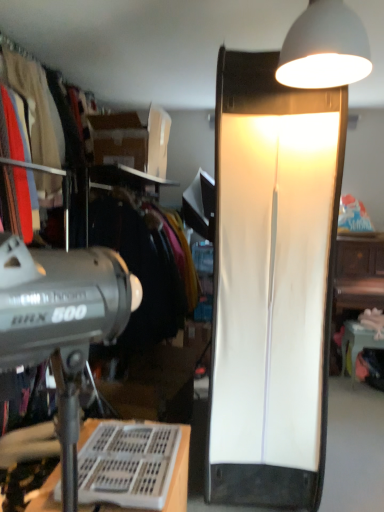
What do you see at coordinates (41, 111) in the screenshot?
I see `matte black clothing at upper left, marked as the first clothing in a back-to-front arrangement` at bounding box center [41, 111].

The width and height of the screenshot is (384, 512). I want to click on white plastic desk at lower left, so click(28, 442).

How much space does white matte lampshade at upper right, the 1th lamp when ordered from bottom to top, occupy vertically?

The height of white matte lampshade at upper right, the 1th lamp when ordered from bottom to top, is 7.06 feet.

This screenshot has width=384, height=512. What do you see at coordinates (37, 108) in the screenshot? I see `smooth cotton shirt at left, placed as the 1th clothing when sorted from front to back` at bounding box center [37, 108].

Identify the location of matte black clothing at upper left, marked as the second clothing in a front-to-back arrangement. (41, 111).

From a real-world perspective, which is physically above, smooth cotton shirt at left, which ranks as the 2th clothing in back-to-front order, or white matte lampshade at upper right, the second lamp when ordered from front to back?

smooth cotton shirt at left, which ranks as the 2th clothing in back-to-front order, is physically above.

Is smooth cotton shirt at left, placed as the 1th clothing when sorted from front to back, to the right of white matte lampshade at upper right, marked as the 1th lamp in a back-to-front arrangement, from the viewer's perspective?

No.

Looking at this image, are smooth cotton shirt at left, placed as the 1th clothing when sorted from front to back, and white matte lampshade at upper right, the second lamp when ordered from front to back, located far from each other?

Yes, smooth cotton shirt at left, placed as the 1th clothing when sorted from front to back, is far from white matte lampshade at upper right, the second lamp when ordered from front to back.

Considering the positions of points (46, 152) and (239, 365), is point (46, 152) farther from camera compared to point (239, 365)?

Yes, it is behind point (239, 365).

Is white matte lampshade at upper right, the 1th lamp when ordered from bottom to top, next to smooth cotton shirt at left, placed as the 1th clothing when sorted from front to back?

No, white matte lampshade at upper right, the 1th lamp when ordered from bottom to top, is not beside smooth cotton shirt at left, placed as the 1th clothing when sorted from front to back.

Could you tell me if white matte lampshade at upper right, the 1th lamp when ordered from bottom to top, is facing smooth cotton shirt at left, which ranks as the 2th clothing in back-to-front order?

No, white matte lampshade at upper right, the 1th lamp when ordered from bottom to top, is not aimed at smooth cotton shirt at left, which ranks as the 2th clothing in back-to-front order.

Which of these two, white matte lampshade at upper right, the second lamp when ordered from front to back, or smooth cotton shirt at left, which ranks as the 2th clothing in back-to-front order, is bigger?

With larger size is white matte lampshade at upper right, the second lamp when ordered from front to back.

Between white matte lampshade at upper right, the second lamp when ordered from front to back, and smooth cotton shirt at left, placed as the 1th clothing when sorted from front to back, which one has smaller width?

smooth cotton shirt at left, placed as the 1th clothing when sorted from front to back.

Is white matte lampshade at upper right, the second lamp viewed from the top, closer to camera compared to white glossy table at lower right?

That is True.

Is white matte lampshade at upper right, the 1th lamp when ordered from bottom to top, inside the boundaries of white glossy table at lower right, or outside?

white matte lampshade at upper right, the 1th lamp when ordered from bottom to top, is spatially situated outside white glossy table at lower right.

Between white matte lampshade at upper right, the second lamp when ordered from front to back, and white glossy table at lower right, which one has larger width?

white matte lampshade at upper right, the second lamp when ordered from front to back, is wider.

Between white matte lampshade at upper right, the second lamp viewed from the top, and white glossy table at lower right, which one has more height?

Standing taller between the two is white matte lampshade at upper right, the second lamp viewed from the top.

Is white glossy table at lower right inside the boundaries of white plastic desk at lower left, or outside?

white glossy table at lower right lies outside white plastic desk at lower left.

Can you confirm if white glossy table at lower right is bigger than white plastic desk at lower left?

Actually, white glossy table at lower right might be smaller than white plastic desk at lower left.

This screenshot has height=512, width=384. Identify the location of table behind the white plastic desk at lower left. (357, 342).

Looking at this image, is white glossy table at lower right beside white plastic desk at lower left?

They are not placed beside each other.

Is white matte lampshade at upper right, positioned as the 1th lamp in front-to-back order, at the back of white matte lampshade at upper right, the 1th lamp when ordered from bottom to top?

No, white matte lampshade at upper right, positioned as the 1th lamp in front-to-back order, is not at the back of white matte lampshade at upper right, the 1th lamp when ordered from bottom to top.

How far apart are white matte lampshade at upper right, the second lamp viewed from the top, and white matte lampshade at upper right, positioned as the 1th lamp in front-to-back order?

20.06 inches.

From the image's perspective, which object appears higher, white matte lampshade at upper right, the second lamp when ordered from front to back, or white matte lampshade at upper right, the first lamp viewed from the top?

white matte lampshade at upper right, the first lamp viewed from the top.

From a real-world perspective, between white matte lampshade at upper right, the second lamp when ordered from front to back, and white matte lampshade at upper right, marked as the second lamp in a back-to-front arrangement, who is vertically higher?

white matte lampshade at upper right, marked as the second lamp in a back-to-front arrangement, is physically above.

In terms of size, does matte black clothing at upper left, marked as the second clothing in a front-to-back arrangement, appear bigger or smaller than white glossy table at lower right?

Considering their sizes, matte black clothing at upper left, marked as the second clothing in a front-to-back arrangement, takes up more space than white glossy table at lower right.

Does point (39, 68) come farther from viewer compared to point (351, 325)?

No, (39, 68) is in front of (351, 325).

Considering their positions, is matte black clothing at upper left, marked as the first clothing in a back-to-front arrangement, located in front of or behind white glossy table at lower right?

Visually, matte black clothing at upper left, marked as the first clothing in a back-to-front arrangement, is located in front of white glossy table at lower right.

Considering the relative positions of matte black clothing at upper left, marked as the first clothing in a back-to-front arrangement, and white glossy table at lower right in the image provided, is matte black clothing at upper left, marked as the first clothing in a back-to-front arrangement, to the left or to the right of white glossy table at lower right?

In the image, matte black clothing at upper left, marked as the first clothing in a back-to-front arrangement, appears on the left side of white glossy table at lower right.

Which point is more distant from viewer, (x=52, y=196) or (x=327, y=376)?

Point (x=52, y=196)

Is white matte lampshade at upper right, the 1th lamp when ordered from bottom to top, a part of matte black clothing at upper left, marked as the first clothing in a back-to-front arrangement?

Actually, white matte lampshade at upper right, the 1th lamp when ordered from bottom to top, is outside matte black clothing at upper left, marked as the first clothing in a back-to-front arrangement.

Looking at this image, would you say matte black clothing at upper left, marked as the second clothing in a front-to-back arrangement, is to the left or to the right of white matte lampshade at upper right, the second lamp viewed from the top, in the picture?

matte black clothing at upper left, marked as the second clothing in a front-to-back arrangement, is to the left of white matte lampshade at upper right, the second lamp viewed from the top.

Considering the positions of objects matte black clothing at upper left, marked as the first clothing in a back-to-front arrangement, and white matte lampshade at upper right, the second lamp when ordered from front to back, in the image provided, who is in front, matte black clothing at upper left, marked as the first clothing in a back-to-front arrangement, or white matte lampshade at upper right, the second lamp when ordered from front to back,?

white matte lampshade at upper right, the second lamp when ordered from front to back.

At what (x,y) coordinates should I click in order to perform the action: click on lamp that is the 1st object located in front of the smooth cotton shirt at left, placed as the 1th clothing when sorted from front to back. Please return your answer as a coordinate pair (x, y). Image resolution: width=384 pixels, height=512 pixels. Looking at the image, I should click on (272, 284).

From the white matte lampshade at upper right, the 1th lamp when ordered from bottom to top, count the 2nd clothing to the left and point to it. Please provide its 2D coordinates.

[(37, 108)]

Estimate the real-world distances between objects in this image. Which object is further from white glossy table at lower right, matte black clothing at upper left, marked as the second clothing in a front-to-back arrangement, or white matte lampshade at upper right, marked as the second lamp in a back-to-front arrangement?

matte black clothing at upper left, marked as the second clothing in a front-to-back arrangement, is further to white glossy table at lower right.

From the image, which object appears to be farther from white matte lampshade at upper right, arranged as the 2th lamp when ordered from the bottom, white matte lampshade at upper right, the second lamp when ordered from front to back, or smooth cotton shirt at left, placed as the 1th clothing when sorted from front to back?

The object further to white matte lampshade at upper right, arranged as the 2th lamp when ordered from the bottom, is smooth cotton shirt at left, placed as the 1th clothing when sorted from front to back.

When comparing their distances from matte black clothing at upper left, marked as the first clothing in a back-to-front arrangement, does white matte lampshade at upper right, arranged as the 2th lamp when ordered from the bottom, or white glossy table at lower right seem further?

white glossy table at lower right is positioned further to the anchor matte black clothing at upper left, marked as the first clothing in a back-to-front arrangement.

Looking at the image, which one is located closer to white matte lampshade at upper right, positioned as the 1th lamp in front-to-back order, matte black clothing at upper left, marked as the second clothing in a front-to-back arrangement, or white plastic desk at lower left?

matte black clothing at upper left, marked as the second clothing in a front-to-back arrangement, is positioned closer to the anchor white matte lampshade at upper right, positioned as the 1th lamp in front-to-back order.

From the image, which object appears to be nearer to white matte lampshade at upper right, the 1th lamp when ordered from bottom to top, smooth cotton shirt at left, placed as the 1th clothing when sorted from front to back, or matte black clothing at upper left, marked as the second clothing in a front-to-back arrangement?

matte black clothing at upper left, marked as the second clothing in a front-to-back arrangement, lies closer to white matte lampshade at upper right, the 1th lamp when ordered from bottom to top, than the other object.

Which object lies further to the anchor point white plastic desk at lower left, white glossy table at lower right or smooth cotton shirt at left, which ranks as the 2th clothing in back-to-front order?

The object further to white plastic desk at lower left is white glossy table at lower right.

From the image, which object appears to be nearer to matte black clothing at upper left, marked as the second clothing in a front-to-back arrangement, white matte lampshade at upper right, marked as the second lamp in a back-to-front arrangement, or white matte lampshade at upper right, marked as the 1th lamp in a back-to-front arrangement?

white matte lampshade at upper right, marked as the 1th lamp in a back-to-front arrangement.

Looking at the image, which one is located further to matte black clothing at upper left, marked as the first clothing in a back-to-front arrangement, white matte lampshade at upper right, the second lamp when ordered from front to back, or smooth cotton shirt at left, placed as the 1th clothing when sorted from front to back?

Among the two, white matte lampshade at upper right, the second lamp when ordered from front to back, is located further to matte black clothing at upper left, marked as the first clothing in a back-to-front arrangement.

Identify the location of desk between matte black clothing at upper left, marked as the first clothing in a back-to-front arrangement, and white glossy table at lower right, in the horizontal direction. (28, 442).

Image resolution: width=384 pixels, height=512 pixels. What are the coordinates of `lamp between smooth cotton shirt at left, placed as the 1th clothing when sorted from front to back, and white plastic desk at lower left from top to bottom` in the screenshot? It's located at (272, 284).

Where is `clothing situated between smooth cotton shirt at left, which ranks as the 2th clothing in back-to-front order, and white matte lampshade at upper right, arranged as the 2th lamp when ordered from the bottom, from left to right`? clothing situated between smooth cotton shirt at left, which ranks as the 2th clothing in back-to-front order, and white matte lampshade at upper right, arranged as the 2th lamp when ordered from the bottom, from left to right is located at coordinates (41, 111).

The image size is (384, 512). What are the coordinates of `clothing between smooth cotton shirt at left, which ranks as the 2th clothing in back-to-front order, and white glossy table at lower right` in the screenshot? It's located at (41, 111).